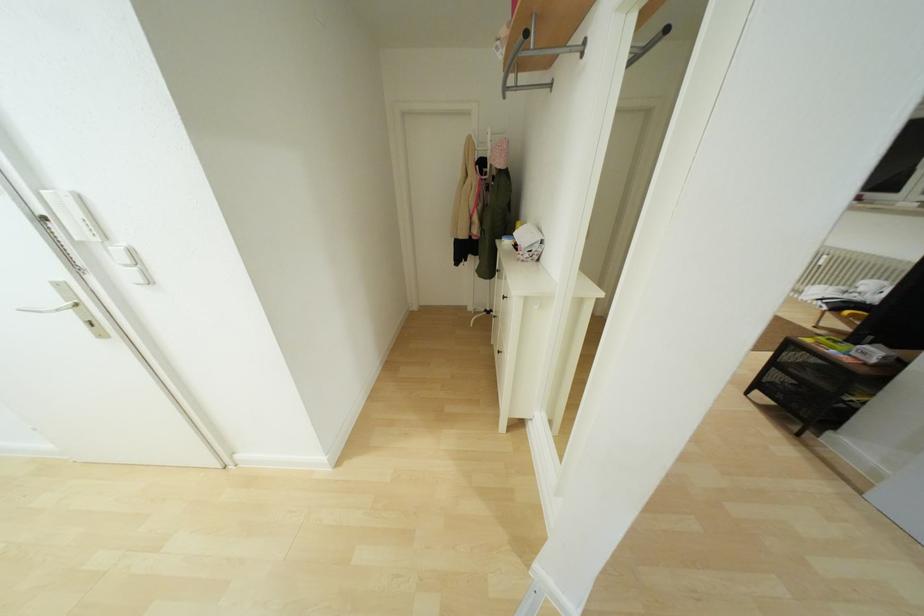
Describe the element at coordinates (528, 243) in the screenshot. I see `a small white basket` at that location.